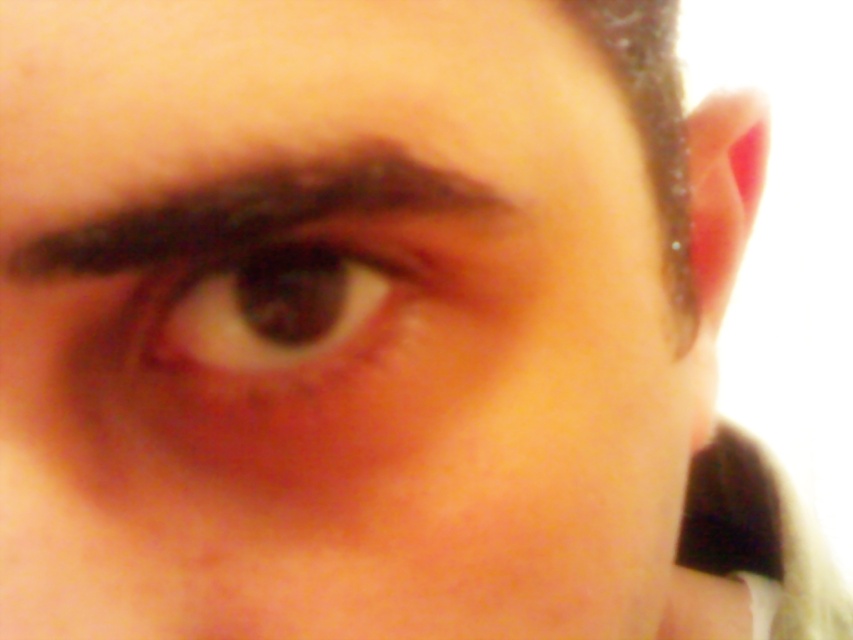
Looking at this image, between dark brown hair at upper left and brown matte eye at center, which one has less height?

With less height is dark brown hair at upper left.

Who is more forward, [279,225] or [252,246]?

Point [279,225] is more forward.

Identify the location of dark brown hair at upper left. This screenshot has height=640, width=853. (286, 220).